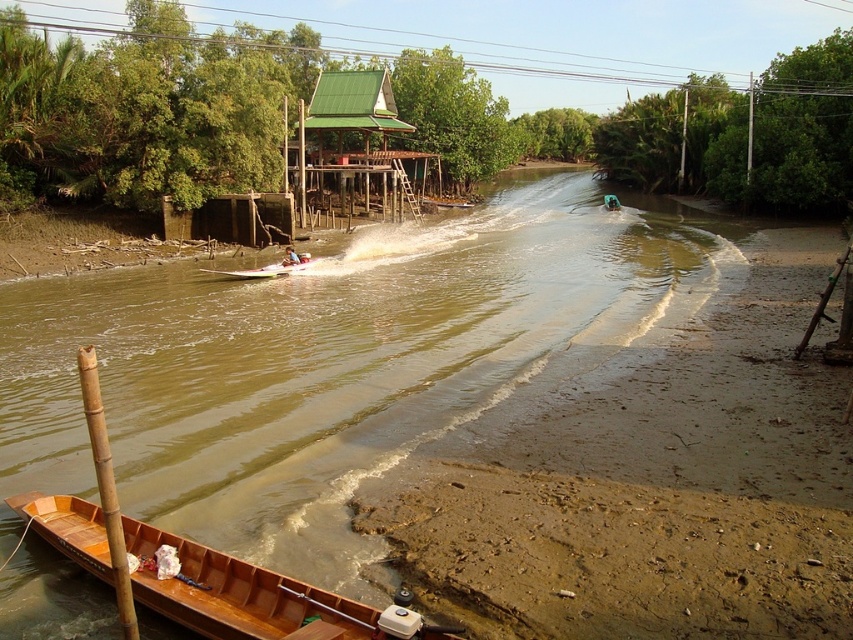
Question: Which point is closer to the camera?

Choices:
 (A) light blue fabric shirt at center
 (B) brown wooden river at center
 (C) wooden boat at lower left

Answer: (C)

Question: From the image, what is the correct spatial relationship of brown wooden river at center in relation to wooden boat at lower left?

Choices:
 (A) right
 (B) left

Answer: (A)

Question: Which of the following is the farthest from the observer?

Choices:
 (A) light blue fabric shirt at center
 (B) brown wooden river at center
 (C) wooden boat at lower left

Answer: (A)

Question: Is wooden boat at lower left thinner than light blue fabric shirt at center?

Choices:
 (A) yes
 (B) no

Answer: (B)

Question: Estimate the real-world distances between objects in this image. Which object is closer to the wooden boat at lower left?

Choices:
 (A) brown wooden river at center
 (B) light blue fabric shirt at center

Answer: (A)

Question: Does wooden boat at lower left appear over light blue fabric shirt at center?

Choices:
 (A) no
 (B) yes

Answer: (A)